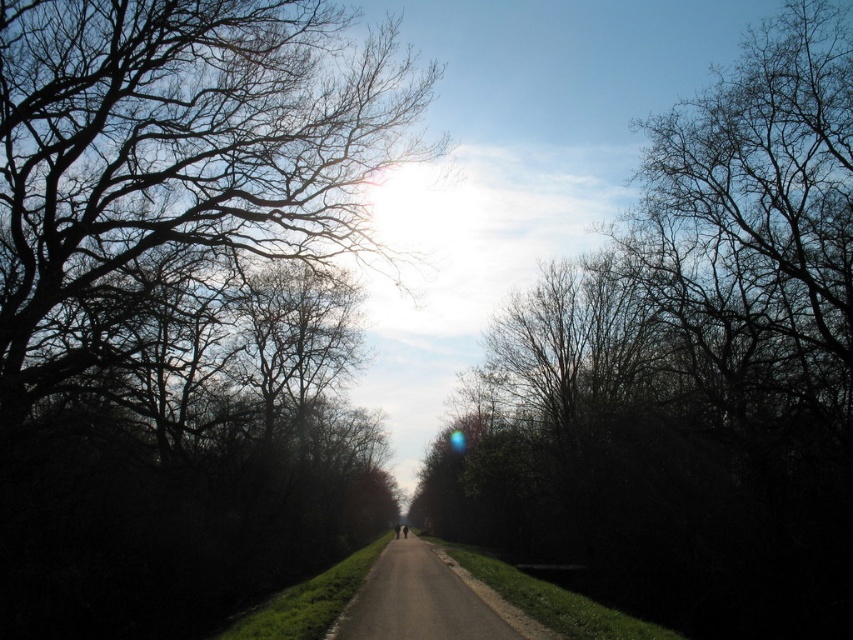
Who is lower down, silhouette bare tree at center or dark asphalt road at center?

Positioned lower is dark asphalt road at center.

Which is in front, point (584, 339) or point (374, 616)?

Positioned in front is point (374, 616).

Does point (747, 244) lie behind point (434, 611)?

Yes.

Where is `silhouette bare tree at center`? This screenshot has width=853, height=640. silhouette bare tree at center is located at coordinates (x=689, y=369).